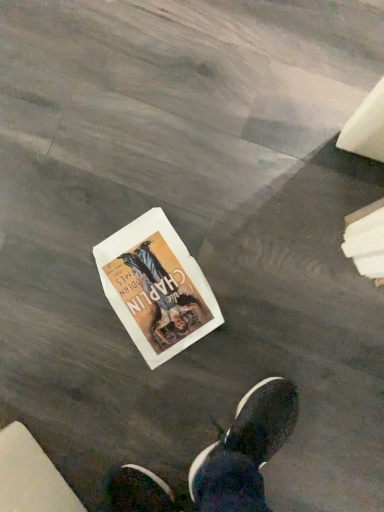
At what (x,y) coordinates should I click in order to perform the action: click on white paper at center. Please return your answer as a coordinate pair (x, y). Looking at the image, I should click on (156, 287).

Describe the element at coordinates (156, 287) in the screenshot. I see `white paper at center` at that location.

Identify the location of white paper at center. (156, 287).